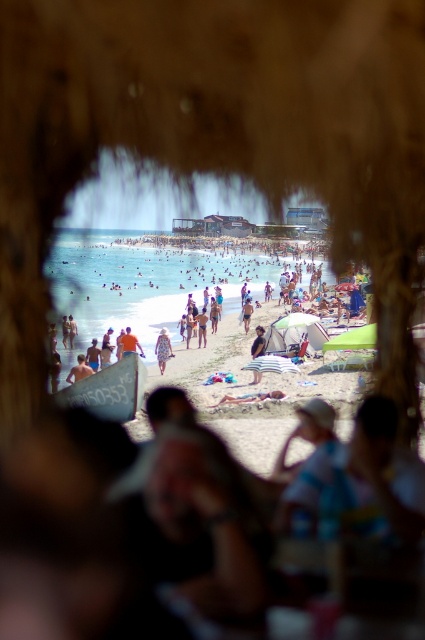
You are a photographer trying to capture a clear shot of the beach scene. You notice the patterned fabric dress at center and the blue fabric umbrella at center. Which object is shorter and might not block your view if you position your camera lower?

The patterned fabric dress at center is shorter than the blue fabric umbrella at center, so positioning the camera lower would allow you to avoid blocking the view by the taller umbrella while the dress is less likely to obstruct the shot.

Based on the photo, you are a beachgoer looking for shade. You see a white fabric towel at center and a blue fabric umbrella at center. Which object is positioned above the other?

The blue fabric umbrella at center is positioned above the white fabric towel at center because the white fabric towel at center is located below the blue fabric umbrella at center.

You are standing at the center of the beach and see two points marked on the sand. The first point is labeled as point (232,401) and the second is point (248,307). If you want to walk towards the point that is closer to the foreground, which point should you head towards?

Point (232,401) is in front of point (248,307), so you should head towards point (232,401) as it is closer to the foreground.